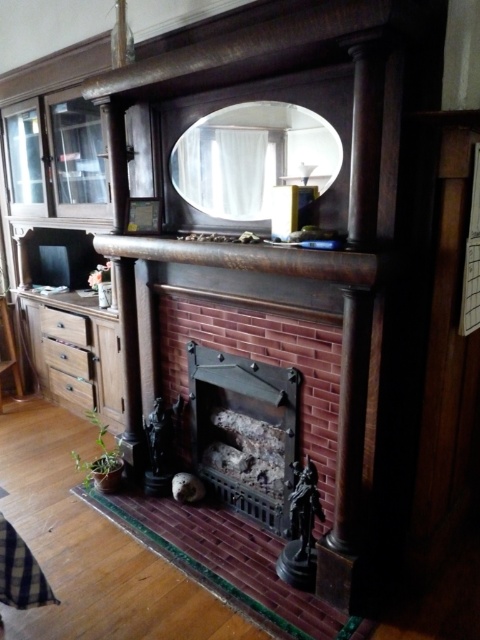
Who is more distant from viewer, (215, 445) or (92, 401)?

The point (92, 401) is more distant.

Does rustic brick fireplace at center have a lesser width compared to matte brown drawer at lower left?

A: No, rustic brick fireplace at center is not thinner than matte brown drawer at lower left.

What do you see at coordinates (244, 432) in the screenshot? I see `rustic brick fireplace at center` at bounding box center [244, 432].

This screenshot has height=640, width=480. I want to click on rustic brick fireplace at center, so click(x=244, y=432).

Can you confirm if rustic brick fireplace at center is positioned to the left of dark wood mantle at center?

In fact, rustic brick fireplace at center is to the right of dark wood mantle at center.

Does point (279, 524) lie in front of point (364, 276)?

No, it is behind (364, 276).

Where is `rustic brick fireplace at center`? The height and width of the screenshot is (640, 480). rustic brick fireplace at center is located at coordinates (244, 432).

Can you confirm if wooden drawer at left is smaller than wooden drawer at lower left?

Actually, wooden drawer at left might be larger than wooden drawer at lower left.

Between wooden drawer at left and wooden drawer at lower left, which one has less height?

wooden drawer at lower left

This screenshot has height=640, width=480. What do you see at coordinates (66, 324) in the screenshot? I see `wooden drawer at left` at bounding box center [66, 324].

I want to click on wooden drawer at left, so click(x=66, y=324).